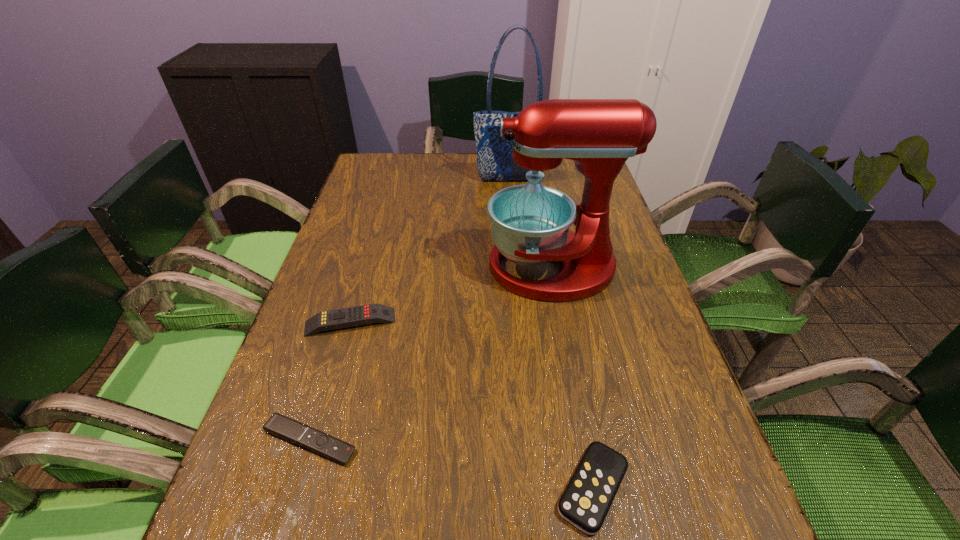
Where is `vacant space that's between the farthest remote control and the shortest remote control`? vacant space that's between the farthest remote control and the shortest remote control is located at coordinates (330, 381).

Find the location of a particular element. This screenshot has width=960, height=540. free space that is in between the mixer and the second tallest remote control is located at coordinates (572, 377).

Locate an element on the screen. free area in between the shortest remote control and the rightmost remote control is located at coordinates (451, 464).

Identify the location of vacant space that is in between the farthest object and the second shortest remote control. This screenshot has width=960, height=540. (552, 334).

Where is `vacant space in between the third nearest object and the second shortest remote control`? This screenshot has height=540, width=960. vacant space in between the third nearest object and the second shortest remote control is located at coordinates coord(471,405).

In order to click on object identified as the fourth closest to the third farthest object in this screenshot , I will do `click(495, 162)`.

Point out which object is positioned as the third nearest to the shopping bag. Please provide its 2D coordinates. Your answer should be formatted as a tuple, i.e. [(x, y)], where the tuple contains the x and y coordinates of a point satisfying the conditions above.

[(278, 425)]

Point out which remote control is positioned as the second nearest to the shortest remote control. Please provide its 2D coordinates. Your answer should be formatted as a tuple, i.e. [(x, y)], where the tuple contains the x and y coordinates of a point satisfying the conditions above.

[(585, 503)]

The width and height of the screenshot is (960, 540). In order to click on the third closest remote control relative to the mixer in this screenshot , I will do `click(278, 425)`.

In order to click on free space that satisfies the following two spatial constraints: 1. on the front-facing side of the second shortest object; 2. on the left side of the second farthest object in this screenshot , I will do `click(593, 488)`.